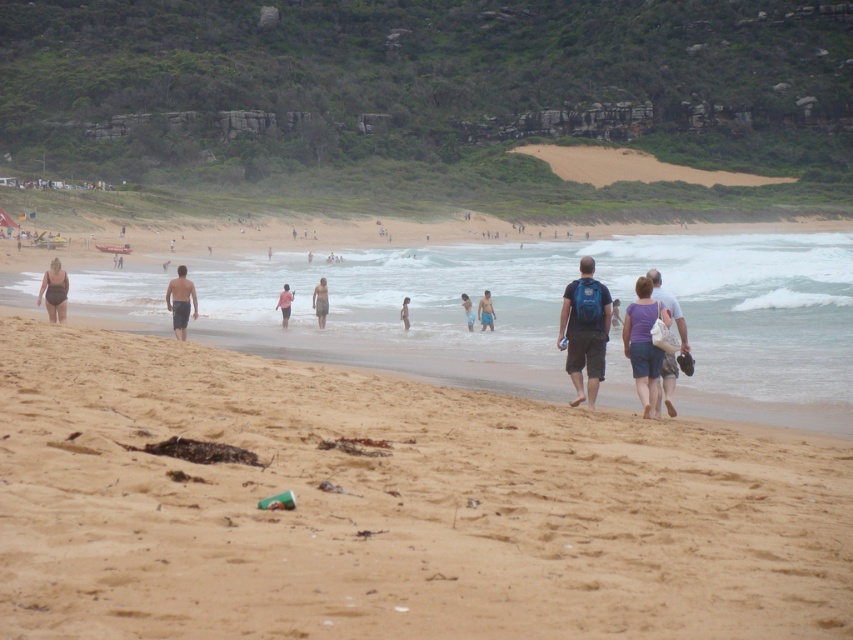
Does brown sandy beach at lower left have a larger size compared to matte black swimsuit at left?

Yes, brown sandy beach at lower left is bigger than matte black swimsuit at left.

Does brown sandy beach at lower left have a greater width compared to matte black swimsuit at left?

Yes, brown sandy beach at lower left is wider than matte black swimsuit at left.

In order to click on brown sandy beach at lower left in this screenshot , I will do click(x=392, y=506).

Does blue backpack at center appear on the left side of light blue shorts at center?

Incorrect, blue backpack at center is not on the left side of light blue shorts at center.

This screenshot has height=640, width=853. I want to click on blue backpack at center, so click(584, 330).

Between point (724, 552) and point (288, 285), which one is positioned in front?

Point (724, 552) is more forward.

Does brown sandy beach at lower left have a smaller size compared to pink fabric at center?

No, brown sandy beach at lower left is not smaller than pink fabric at center.

Is point (535, 435) more distant than point (281, 310)?

No, it is in front of (281, 310).

At what (x,y) coordinates should I click in order to perform the action: click on brown sandy beach at lower left. Please return your answer as a coordinate pair (x, y). Looking at the image, I should click on (392, 506).